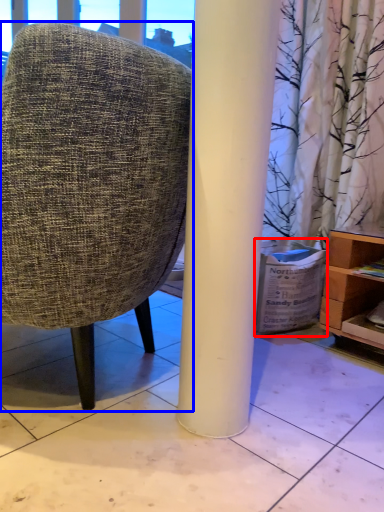
Question: Which object appears closest to the camera in this image, cardboard box (highlighted by a red box) or chair (highlighted by a blue box)?

Choices:
 (A) cardboard box
 (B) chair

Answer: (B)